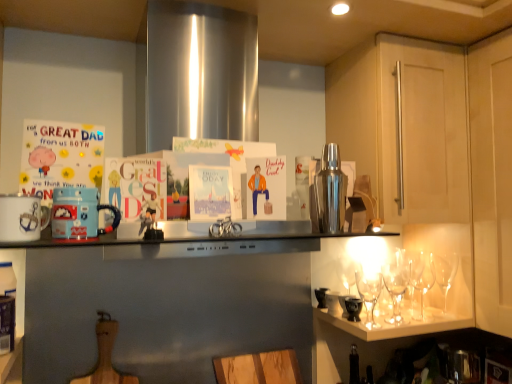
Locate an element on the screen. matte cardboard postcard at left is located at coordinates (60, 157).

Where is `metallic silver countertop at center`? The height and width of the screenshot is (384, 512). metallic silver countertop at center is located at coordinates (182, 238).

At what (x,y) coordinates should I click in order to perform the action: click on wooden cutting board at lower center. Please return your answer as a coordinate pair (x, y). The height and width of the screenshot is (384, 512). Looking at the image, I should click on (258, 368).

What is the approximate width of wooden cutting board at lower center?

wooden cutting board at lower center is 2.74 inches wide.

Describe the element at coordinates (330, 192) in the screenshot. I see `shiny metallic cocktail shaker at upper right, the third appliance in the left-to-right sequence` at that location.

Locate an element on the screen. The height and width of the screenshot is (384, 512). matte blue mug at left, which is the first appliance in front-to-back order is located at coordinates (79, 213).

What do you see at coordinates (79, 213) in the screenshot? I see `matte blue mug at left, the second appliance positioned from the left` at bounding box center [79, 213].

Locate an element on the screen. The height and width of the screenshot is (384, 512). matte cardboard postcard at left is located at coordinates pos(60,157).

Could you tell me if clear glassware at lower right is turned towards matte blue mug at left, acting as the second appliance starting from the right?

No, clear glassware at lower right is not turned towards matte blue mug at left, acting as the second appliance starting from the right.

Is clear glassware at lower right shorter than matte blue mug at left, the second appliance positioned from the left?

Indeed, clear glassware at lower right has a lesser height compared to matte blue mug at left, the second appliance positioned from the left.

How different are the orientations of clear glassware at lower right and matte blue mug at left, the second appliance positioned from the left, in degrees?

3.22 degrees separate the facing orientations of clear glassware at lower right and matte blue mug at left, the second appliance positioned from the left.

Locate an element on the screen. This screenshot has height=384, width=512. appliance that is the 2nd one when counting leftward from the clear glassware at lower right is located at coordinates (79, 213).

Is point (321, 212) positioned before point (257, 235)?

No, it is behind (257, 235).

Is shiny metallic cocktail shaker at upper right, the first appliance when ordered from right to left, positioned far away from metallic silver countertop at center?

shiny metallic cocktail shaker at upper right, the first appliance when ordered from right to left, is actually quite close to metallic silver countertop at center.

Can you tell me how much shiny metallic cocktail shaker at upper right, the 3th appliance when ordered from front to back, and metallic silver countertop at center differ in facing direction?

4.21 degrees.

Does shiny metallic cocktail shaker at upper right, the first appliance from the back, have a greater height compared to metallic silver countertop at center?

Yes.

Considering the positions of point (336, 212) and point (10, 239), is point (336, 212) closer or farther from the camera than point (10, 239)?

Clearly, point (336, 212) is more distant from the camera than point (10, 239).

From the image's perspective, which appliance is the 2nd one below the shiny metallic cocktail shaker at upper right, the 3th appliance when ordered from front to back? Please provide its 2D coordinates.

[(22, 218)]

From the image's perspective, is matte cardboard postcard at left positioned above or below clear glassware at lower right?

Based on their image positions, matte cardboard postcard at left is located above clear glassware at lower right.

Is matte cardboard postcard at left located outside clear glassware at lower right?

matte cardboard postcard at left lies outside clear glassware at lower right's area.

Which of these two, matte cardboard postcard at left or clear glassware at lower right, stands shorter?

clear glassware at lower right.

Does matte cardboard postcard at left turn towards clear glassware at lower right?

No, matte cardboard postcard at left does not turn towards clear glassware at lower right.

I want to click on postcard above the shiny metallic cocktail shaker at upper right, the third appliance in the left-to-right sequence (from the image's perspective), so click(x=60, y=157).

Could you measure the distance between matte cardboard postcard at left and shiny metallic cocktail shaker at upper right, the first appliance from the back?

matte cardboard postcard at left is 23.72 inches away from shiny metallic cocktail shaker at upper right, the first appliance from the back.

Which is correct: matte cardboard postcard at left is inside shiny metallic cocktail shaker at upper right, the first appliance from the back, or outside of it?

matte cardboard postcard at left cannot be found inside shiny metallic cocktail shaker at upper right, the first appliance from the back.

Which is further, (80, 156) or (332, 230)?

The point (332, 230) is more distant.

Is matte blue mug at left, the third appliance positioned from the back, facing away from shiny metallic cocktail shaker at upper right, the first appliance when ordered from right to left?

No, matte blue mug at left, the third appliance positioned from the back,'s orientation is not away from shiny metallic cocktail shaker at upper right, the first appliance when ordered from right to left.

Which object is closer to the camera, matte blue mug at left, the second appliance positioned from the left, or shiny metallic cocktail shaker at upper right, the 3th appliance when ordered from front to back?

matte blue mug at left, the second appliance positioned from the left, is in front.

Is matte blue mug at left, the third appliance positioned from the back, not close to shiny metallic cocktail shaker at upper right, the third appliance in the left-to-right sequence?

No, matte blue mug at left, the third appliance positioned from the back, is not far away from shiny metallic cocktail shaker at upper right, the third appliance in the left-to-right sequence.

In the scene shown: Is wooden cutting board at lower center taller than light wood cabinet at right, arranged as the 1th cabinetry when viewed from the front?

No.

Considering the positions of points (279, 350) and (415, 235), is point (279, 350) closer to camera compared to point (415, 235)?

That is True.

Considering the positions of objects wooden cutting board at lower center and light wood cabinet at right, which is the second cabinetry in back-to-front order, in the image provided, who is more to the left, wooden cutting board at lower center or light wood cabinet at right, which is the second cabinetry in back-to-front order,?

From the viewer's perspective, wooden cutting board at lower center appears more on the left side.

At what (x,y) coordinates should I click in order to perform the action: click on shelf lying behind the matte blue mug at left, which is the first appliance in front-to-back order. Please return your answer as a coordinate pair (x, y). Looking at the image, I should click on (392, 327).

Image resolution: width=512 pixels, height=384 pixels. In order to click on countertop in front of the shiny metallic cocktail shaker at upper right, the first appliance when ordered from right to left in this screenshot , I will do `click(182, 238)`.

Looking at the image, which one is located further to metallic silver countertop at center, matte blue mug at left, the second appliance positioned from the left, or matte cardboard postcard at left?

matte cardboard postcard at left.

Based on the photo, when comparing their distances from light wood cabinet at right, which is the second cabinetry in back-to-front order, does matte cardboard postcard at left or shiny metallic cocktail shaker at upper right, the third appliance in the left-to-right sequence, seem closer?

shiny metallic cocktail shaker at upper right, the third appliance in the left-to-right sequence, is closer to light wood cabinet at right, which is the second cabinetry in back-to-front order.

Based on their spatial positions, is metallic silver countertop at center or matte cardboard postcard at left further from shiny metallic cocktail shaker at upper right, the first appliance from the back?

matte cardboard postcard at left is further to shiny metallic cocktail shaker at upper right, the first appliance from the back.

Estimate the real-world distances between objects in this image. Which object is closer to light wood cabinet at right, which is the second cabinetry in back-to-front order, shiny metallic cocktail shaker at upper right, the third appliance in the left-to-right sequence, or matte cardboard postcard at left?

Based on the image, shiny metallic cocktail shaker at upper right, the third appliance in the left-to-right sequence, appears to be nearer to light wood cabinet at right, which is the second cabinetry in back-to-front order.

Considering their positions, is matte blue mug at left, acting as the second appliance starting from the right, positioned closer to light wood cabinet at right, which is the second cabinetry in back-to-front order, than shiny metallic cocktail shaker at upper right, the first appliance from the back?

shiny metallic cocktail shaker at upper right, the first appliance from the back, is closer to light wood cabinet at right, which is the second cabinetry in back-to-front order.

Estimate the real-world distances between objects in this image. Which object is further from light wood cabinet at right, which is the second cabinetry in back-to-front order, matte cardboard postcard at left or metallic silver countertop at center?

matte cardboard postcard at left lies further to light wood cabinet at right, which is the second cabinetry in back-to-front order, than the other object.

Consider the image. From the image, which object appears to be nearer to matte blue mug at left, the second appliance positioned from the left, wooden cutting board at lower center or light wood cabinet door at upper right, the first cabinetry from the back?

Among the two, wooden cutting board at lower center is located nearer to matte blue mug at left, the second appliance positioned from the left.

Considering their positions, is matte blue mug at left, acting as the second appliance starting from the right, positioned further to clear glassware at lower right than white ceramic mug at left, which is counted as the first appliance, starting from the left?

Based on the image, white ceramic mug at left, which is counted as the first appliance, starting from the left, appears to be further to clear glassware at lower right.

You are a GUI agent. You are given a task and a screenshot of the screen. Output one action in this format:
    pyautogui.click(x=<x>, y=<y>)
    Task: Click on the countertop situated between matte cardboard postcard at left and shiny metallic cocktail shaker at upper right, the first appliance when ordered from right to left, from left to right
    The height and width of the screenshot is (384, 512).
    Given the screenshot: What is the action you would take?
    pyautogui.click(x=182, y=238)

Identify the location of countertop between matte cardboard postcard at left and wooden cutting board at lower center from top to bottom. (182, 238).

Locate an element on the screen. The height and width of the screenshot is (384, 512). cabinetry that lies between light wood cabinet door at upper right, the first cabinetry from the back, and clear glassware at lower right from top to bottom is located at coordinates tap(428, 179).

At what (x,y) coordinates should I click in order to perform the action: click on cabinetry between white ceramic mug at left, which ranks as the 2th appliance in back-to-front order, and light wood cabinet at right, arranged as the 1th cabinetry when viewed from the front, from left to right. Please return your answer as a coordinate pair (x, y). The image size is (512, 384). Looking at the image, I should click on (404, 125).